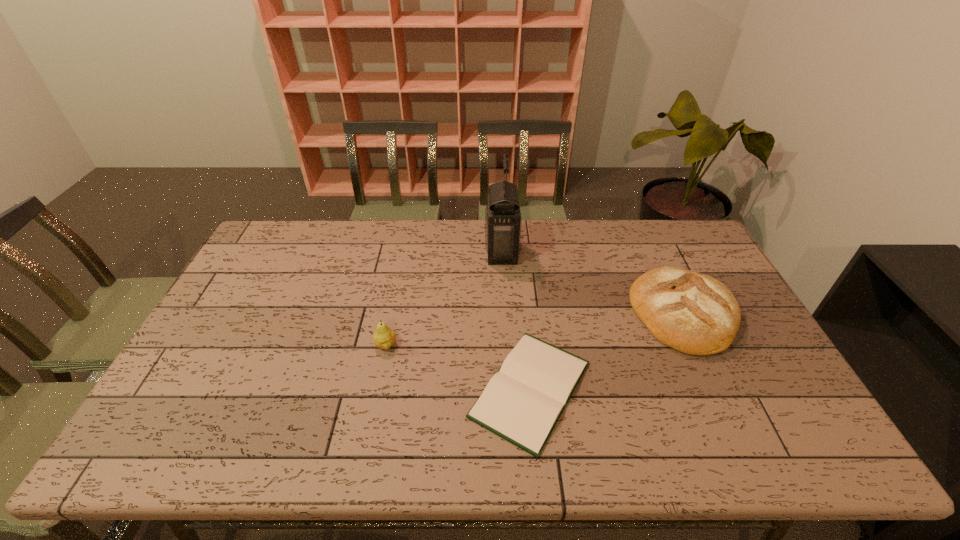
Identify the location of free space at the near right corner. (802, 457).

This screenshot has height=540, width=960. Find the location of `free space between the rightmost object and the pear`. free space between the rightmost object and the pear is located at coordinates (535, 329).

Where is `vacant space in between the tallest object and the hardback book`? The width and height of the screenshot is (960, 540). vacant space in between the tallest object and the hardback book is located at coordinates (516, 321).

This screenshot has width=960, height=540. I want to click on free spot between the rightmost object and the tallest object, so click(x=592, y=283).

This screenshot has width=960, height=540. Identify the location of vacant area that lies between the bread and the pear. (535, 329).

Identify the location of free space that is in between the pear and the shortest object. (458, 367).

I want to click on empty space between the shortest object and the lantern, so click(516, 321).

Where is `vacant area that lies between the leftmost object and the hardback book`? vacant area that lies between the leftmost object and the hardback book is located at coordinates (458, 367).

You are a GUI agent. You are given a task and a screenshot of the screen. Output one action in this format:
    pyautogui.click(x=<x>, y=<y>)
    Task: Click on the empty space that is in between the rightmost object and the leftmost object
    Image resolution: width=960 pixels, height=540 pixels.
    Given the screenshot: What is the action you would take?
    pyautogui.click(x=535, y=329)

This screenshot has height=540, width=960. In order to click on blank region between the rightmost object and the shortest object in this screenshot , I will do `click(607, 351)`.